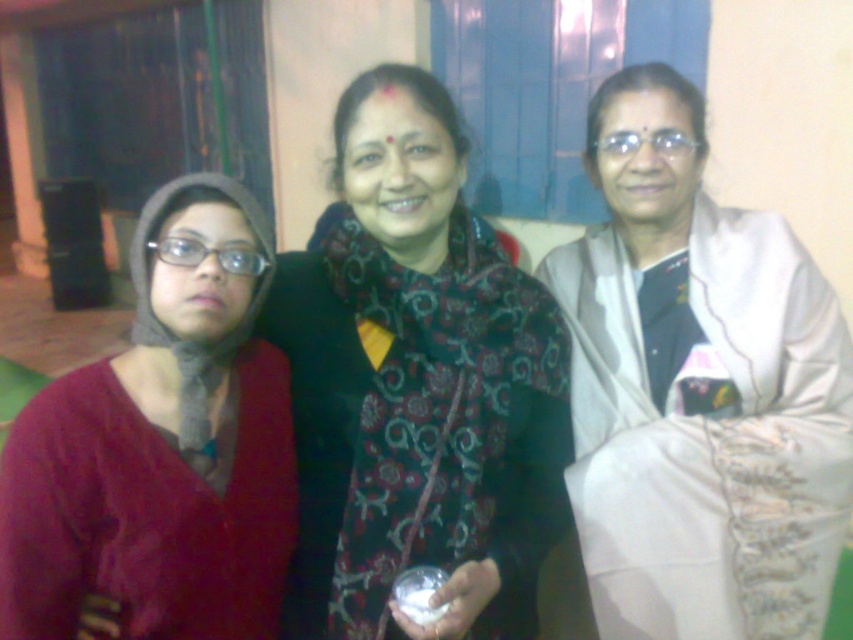
You are organizing a fashion show and need to display the white satin saree at right and the knitted woolen scarf at left. Since space is limited, you must determine which item requires more horizontal space to display properly. Based on the image, which item should be allocated more space?

The white satin saree at right requires more horizontal space because its width is larger than the knitted woolen scarf at left.

You are a photographer setting up for a group photo. The subjects are wearing a white satin saree at right and a knitted woolen scarf at left. You need to position a microphone stand between them. Given the space between them, will a 24 inch wide stand fit without overlapping either clothing item?

The distance between the white satin saree at right and the knitted woolen scarf at left is 26.09 inches. A 24 inch wide stand would fit since 24 is less than 26.09, leaving about 2 inches of space on each side.